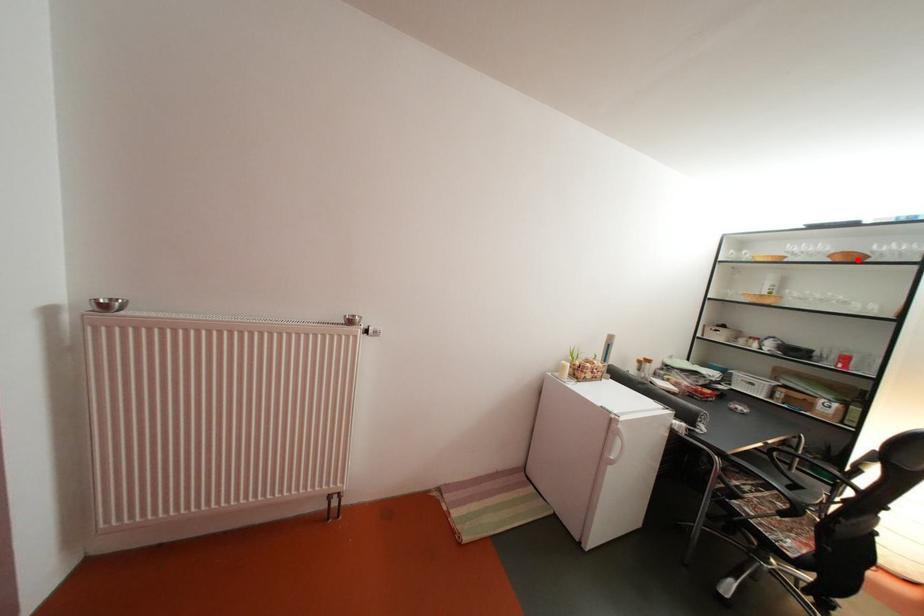
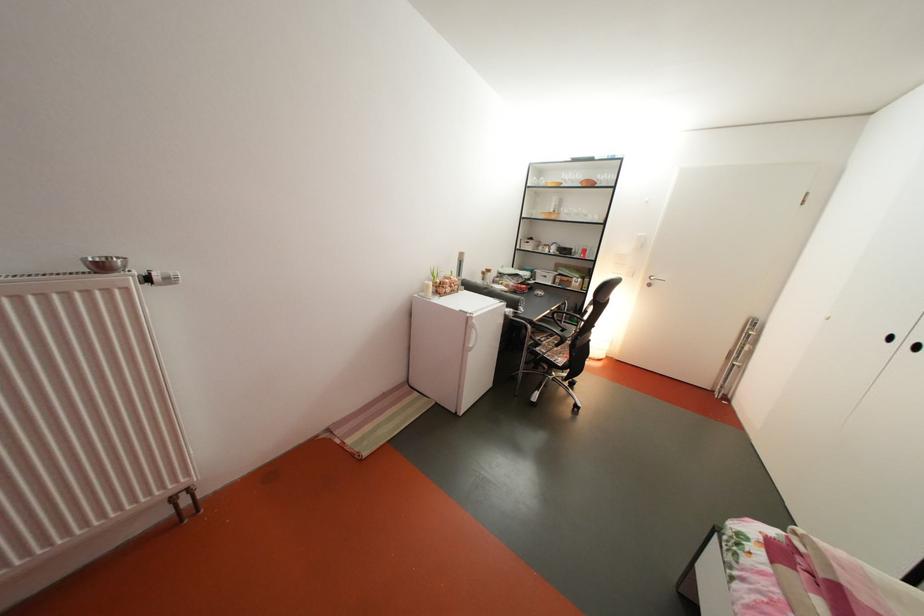
Question: A red point is marked in image1. In image2, is the corresponding 3D point closer to the camera or farther? Reply with the corresponding letter.

Choices:
 (A) The corresponding 3D point is closer.
 (B) The corresponding 3D point is farther.

Answer: (A)